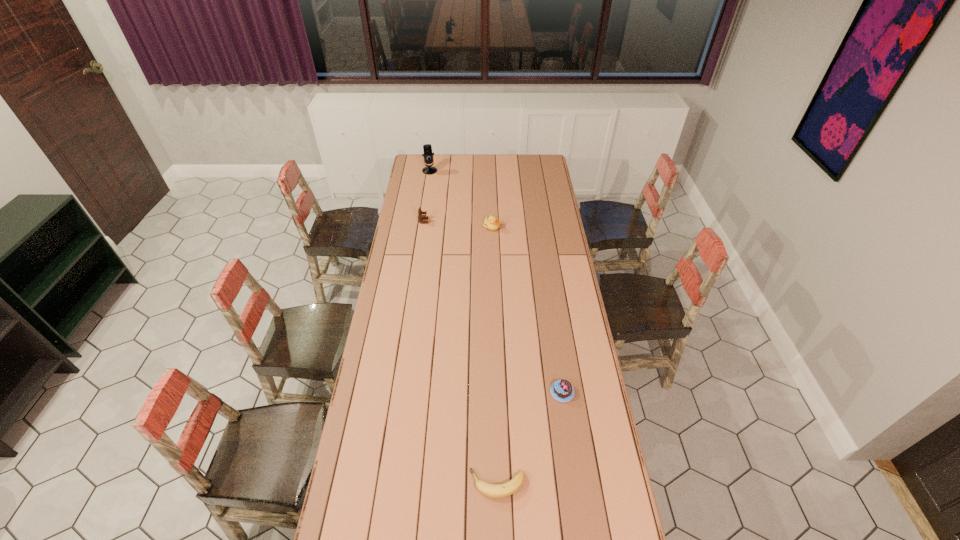
Find the location of a particular element. This screenshot has height=540, width=960. the farthest object is located at coordinates (427, 148).

Where is `the tallest object`? the tallest object is located at coordinates (427, 148).

Find the location of a particular element. teddy bear is located at coordinates (420, 217).

I want to click on duckling, so click(491, 222).

At what (x,y) coordinates should I click in order to perform the action: click on the fourth tallest object. Please return your answer as a coordinate pair (x, y). Looking at the image, I should click on (562, 390).

Identify the location of the second nearest object. The width and height of the screenshot is (960, 540). (562, 390).

Identify the location of the shortest object. point(491,490).

Find the location of `banana`. banana is located at coordinates (491, 490).

Where is `free space located 0.140m on the stand of the tallest object`? Image resolution: width=960 pixels, height=540 pixels. free space located 0.140m on the stand of the tallest object is located at coordinates (427, 188).

At what (x,y) coordinates should I click in order to perform the action: click on free space located 0.220m on the face of the teddy bear. Please return your answer as a coordinate pair (x, y). Looking at the image, I should click on (469, 221).